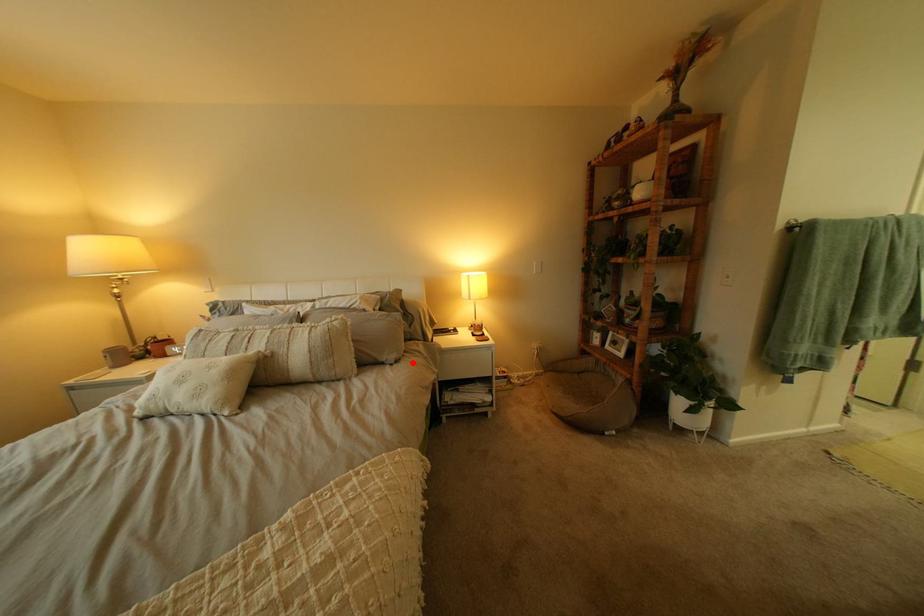
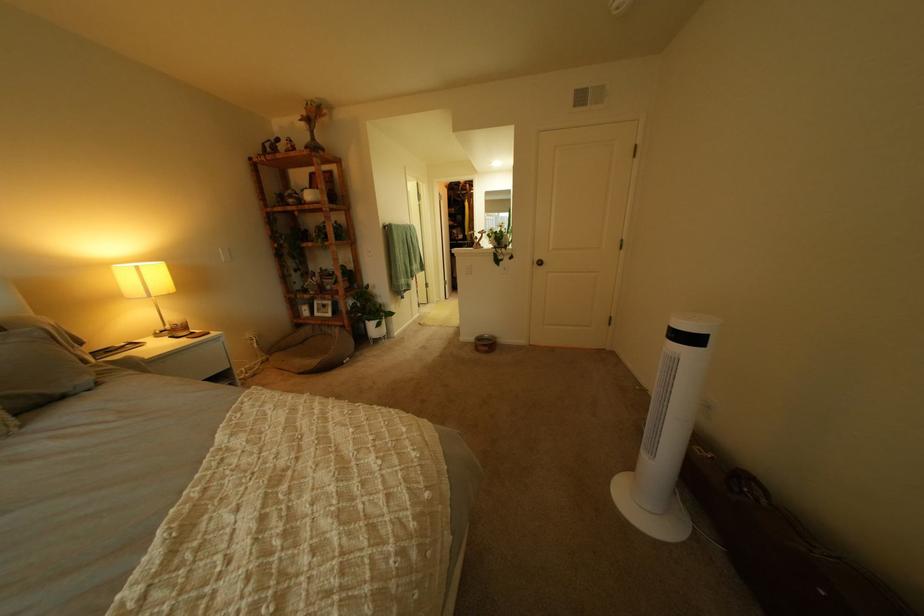
In the second image, find the point that corresponds to the highlighted location in the first image.

(115, 385)